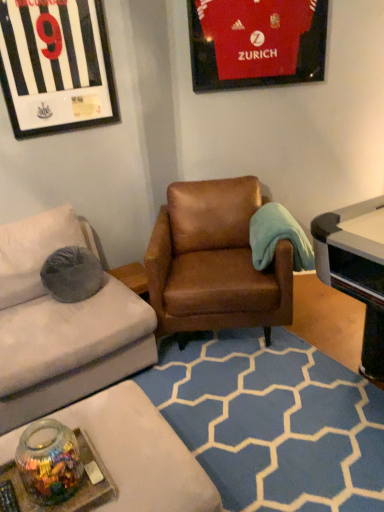
Question: Is matte red jersey at upper right, the second picture frame from the left, completely or partially inside black plastic remote control at lower left?

Choices:
 (A) yes
 (B) no

Answer: (B)

Question: Can you confirm if black plastic remote control at lower left is positioned to the right of matte red jersey at upper right, the second picture frame from the left?

Choices:
 (A) yes
 (B) no

Answer: (B)

Question: Is black plastic remote control at lower left facing away from matte red jersey at upper right, arranged as the 1th picture frame when viewed from the right?

Choices:
 (A) yes
 (B) no

Answer: (B)

Question: Is black plastic remote control at lower left far from matte red jersey at upper right, the second picture frame from the left?

Choices:
 (A) no
 (B) yes

Answer: (B)

Question: Are black plastic remote control at lower left and matte red jersey at upper right, arranged as the 1th picture frame when viewed from the right, making contact?

Choices:
 (A) yes
 (B) no

Answer: (B)

Question: Does black plastic remote control at lower left come in front of matte red jersey at upper right, the second picture frame from the left?

Choices:
 (A) no
 (B) yes

Answer: (B)

Question: Can you confirm if matte red jersey at upper right, arranged as the 1th picture frame when viewed from the right, is positioned to the right of black plastic remote control at lower left?

Choices:
 (A) no
 (B) yes

Answer: (B)

Question: From a real-world perspective, is matte red jersey at upper right, the second picture frame from the left, on black plastic remote control at lower left?

Choices:
 (A) yes
 (B) no

Answer: (A)

Question: Considering the relative positions of matte red jersey at upper right, arranged as the 1th picture frame when viewed from the right, and black plastic remote control at lower left in the image provided, is matte red jersey at upper right, arranged as the 1th picture frame when viewed from the right, behind black plastic remote control at lower left?

Choices:
 (A) no
 (B) yes

Answer: (B)

Question: Is matte red jersey at upper right, arranged as the 1th picture frame when viewed from the right, thinner than black plastic remote control at lower left?

Choices:
 (A) yes
 (B) no

Answer: (A)

Question: From the image's perspective, is matte red jersey at upper right, arranged as the 1th picture frame when viewed from the right, on black plastic remote control at lower left?

Choices:
 (A) yes
 (B) no

Answer: (A)

Question: Is matte red jersey at upper right, arranged as the 1th picture frame when viewed from the right, closer to camera compared to black plastic remote control at lower left?

Choices:
 (A) yes
 (B) no

Answer: (B)

Question: Is brown leather armchair at center inside black plastic remote control at lower left?

Choices:
 (A) no
 (B) yes

Answer: (A)